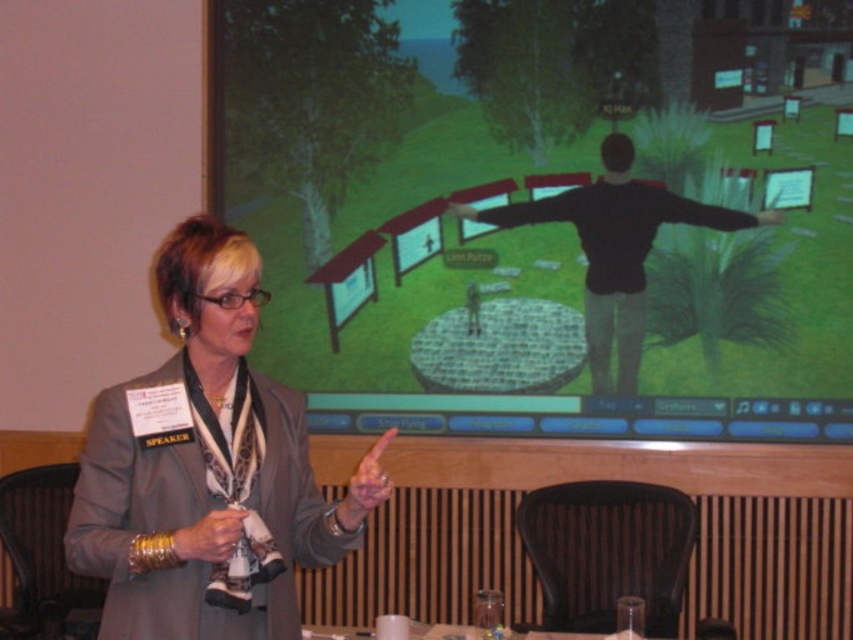
Question: Which object is positioned farthest from the gray fabric jacket at center?

Choices:
 (A) black matte shirt at center
 (B) matte black projection screen at upper center

Answer: (A)

Question: Is the position of matte black projection screen at upper center less distant than that of black matte shirt at center?

Choices:
 (A) yes
 (B) no

Answer: (A)

Question: Which object is farther from the camera taking this photo?

Choices:
 (A) black matte shirt at center
 (B) matte black projection screen at upper center

Answer: (A)

Question: Observing the image, what is the correct spatial positioning of matte black projection screen at upper center in reference to black matte shirt at center?

Choices:
 (A) above
 (B) below

Answer: (A)

Question: In this image, where is matte black projection screen at upper center located relative to gray fabric jacket at center?

Choices:
 (A) below
 (B) above

Answer: (B)

Question: Which object is closer to the camera taking this photo?

Choices:
 (A) black matte shirt at center
 (B) gray fabric jacket at center
 (C) matte black projection screen at upper center

Answer: (B)